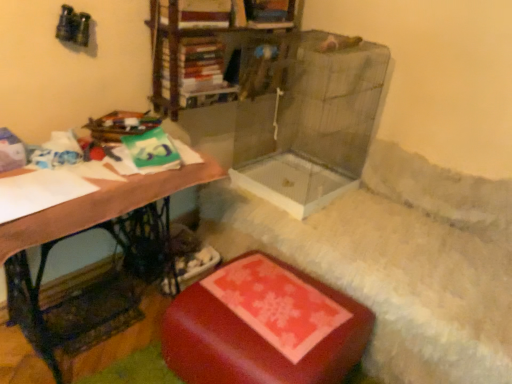
What is the approximate height of metallic bookshelf at upper center?

It is 18.87 inches.

What do you see at coordinates (264, 328) in the screenshot? I see `rubberized red ottoman at lower center` at bounding box center [264, 328].

The image size is (512, 384). In order to click on metallic bookshelf at upper center in this screenshot , I will do `click(218, 51)`.

Looking at the image, does metallic bookshelf at upper center seem bigger or smaller compared to wooden desk at left?

metallic bookshelf at upper center is smaller than wooden desk at left.

Is wooden desk at left at the back of metallic bookshelf at upper center?

metallic bookshelf at upper center is not turned away from wooden desk at left.

From the image's perspective, between metallic bookshelf at upper center and wooden desk at left, who is located below?

wooden desk at left is shown below in the image.

Which object is thinner, metallic bookshelf at upper center or wooden desk at left?

With smaller width is metallic bookshelf at upper center.

Between rubberized red ottoman at lower center and hardcover book at upper center, which one is positioned in front?

rubberized red ottoman at lower center is closer to the camera.

Is rubberized red ottoman at lower center aimed at hardcover book at upper center?

No.

Is rubberized red ottoman at lower center next to hardcover book at upper center and touching it?

rubberized red ottoman at lower center and hardcover book at upper center are not in contact.

From a real-world perspective, is metallic bookshelf at upper center located beneath rubberized red ottoman at lower center?

No, from a real-world perspective, metallic bookshelf at upper center is not under rubberized red ottoman at lower center.

I want to click on shelf lying above the rubberized red ottoman at lower center (from the image's perspective), so click(x=218, y=51).

Between metallic bookshelf at upper center and rubberized red ottoman at lower center, which one has smaller width?

Thinner between the two is metallic bookshelf at upper center.

Is metallic bookshelf at upper center facing away from rubberized red ottoman at lower center?

metallic bookshelf at upper center does not have its back to rubberized red ottoman at lower center.

Is wooden desk at left with metallic bookshelf at upper center?

wooden desk at left is not next to metallic bookshelf at upper center, and they're not touching.

Which is in front, wooden desk at left or metallic bookshelf at upper center?

wooden desk at left is more forward.

Does point (44, 230) appear closer or farther from the camera than point (182, 37)?

Point (44, 230) is positioned closer to the camera compared to point (182, 37).

Considering the sizes of objects rubberized red ottoman at lower center and metallic bookshelf at upper center in the image provided, who is thinner, rubberized red ottoman at lower center or metallic bookshelf at upper center?

Thinner between the two is metallic bookshelf at upper center.

Which is more to the right, rubberized red ottoman at lower center or metallic bookshelf at upper center?

rubberized red ottoman at lower center is more to the right.

Is rubberized red ottoman at lower center not within metallic bookshelf at upper center?

Absolutely, rubberized red ottoman at lower center is external to metallic bookshelf at upper center.

Which point is more forward, [332,324] or [265,32]?

The point [332,324] is closer.

Visually, is metallic bookshelf at upper center positioned to the left or to the right of hardcover book at upper center?

metallic bookshelf at upper center is to the right of hardcover book at upper center.

Which is nearer, [176,104] or [197,77]?

Point [176,104]

Is metallic bookshelf at upper center wider than hardcover book at upper center?

No, metallic bookshelf at upper center is not wider than hardcover book at upper center.

How many degrees apart are the facing directions of hardcover book at upper center and wooden desk at left?

There is a 0.267-degree angle between the facing directions of hardcover book at upper center and wooden desk at left.

Would you consider hardcover book at upper center to be distant from wooden desk at left?

They are positioned close to each other.

Between hardcover book at upper center and wooden desk at left, which one has more height?

With more height is wooden desk at left.

Does point (216, 81) appear closer or farther from the camera than point (213, 175)?

Point (216, 81) appears to be farther away from the viewer than point (213, 175).

Identify the location of shelf that is above the wooden desk at left (from the image's perspective). tap(218, 51).

You are a GUI agent. You are given a task and a screenshot of the screen. Output one action in this format:
    pyautogui.click(x=<x>, y=<y>)
    Task: Click on the book lying behind the rubberized red ottoman at lower center
    This screenshot has width=512, height=384.
    Given the screenshot: What is the action you would take?
    pyautogui.click(x=193, y=66)

Looking at the image, which one is located further to rubberized red ottoman at lower center, hardcover book at upper center or metallic bookshelf at upper center?

Among the two, hardcover book at upper center is located further to rubberized red ottoman at lower center.

From the image, which object appears to be farther from hardcover book at upper center, wooden desk at left or rubberized red ottoman at lower center?

Answer: Based on the image, rubberized red ottoman at lower center appears to be further to hardcover book at upper center.

Based on their spatial positions, is wooden desk at left or metallic bookshelf at upper center closer to rubberized red ottoman at lower center?

wooden desk at left is closer to rubberized red ottoman at lower center.

Which object lies nearer to the anchor point metallic bookshelf at upper center, rubberized red ottoman at lower center or hardcover book at upper center?

Based on the image, hardcover book at upper center appears to be nearer to metallic bookshelf at upper center.

Considering their positions, is hardcover book at upper center positioned further to metallic bookshelf at upper center than rubberized red ottoman at lower center?

The object further to metallic bookshelf at upper center is rubberized red ottoman at lower center.

When comparing their distances from wooden desk at left, does hardcover book at upper center or metallic bookshelf at upper center seem further?

metallic bookshelf at upper center is positioned further to the anchor wooden desk at left.

Which object lies further to the anchor point metallic bookshelf at upper center, hardcover book at upper center or wooden desk at left?

wooden desk at left lies further to metallic bookshelf at upper center than the other object.

When comparing their distances from hardcover book at upper center, does rubberized red ottoman at lower center or metallic bookshelf at upper center seem further?

rubberized red ottoman at lower center is positioned further to the anchor hardcover book at upper center.

Identify the location of book between metallic bookshelf at upper center and rubberized red ottoman at lower center in the vertical direction. (193, 66).

Locate an element on the screen. table between hardcover book at upper center and rubberized red ottoman at lower center in the vertical direction is located at coordinates (101, 204).

Identify the location of table between metallic bookshelf at upper center and rubberized red ottoman at lower center in the vertical direction. tap(101, 204).

The width and height of the screenshot is (512, 384). Find the location of `book between metallic bookshelf at upper center and wooden desk at left in the up-down direction`. book between metallic bookshelf at upper center and wooden desk at left in the up-down direction is located at coordinates (193, 66).